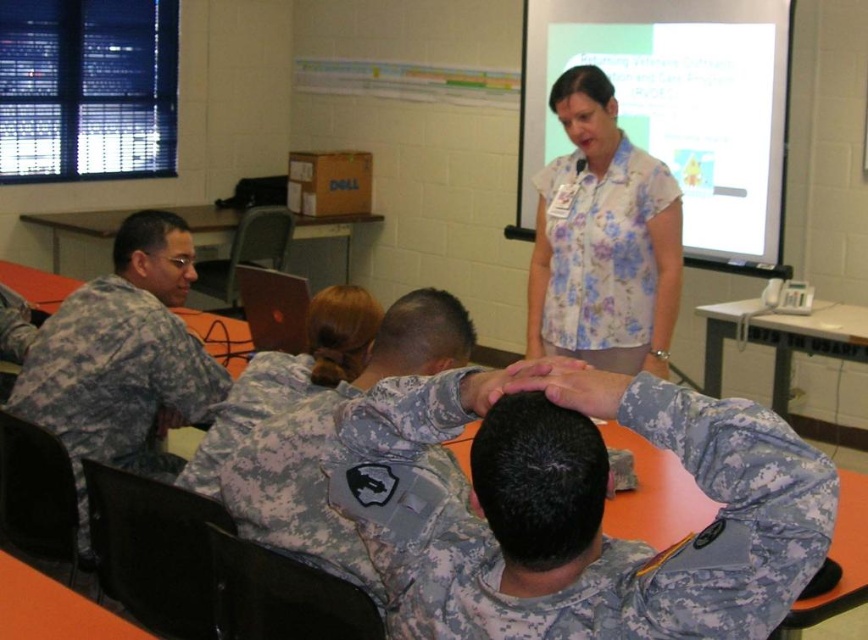
Question: Which object is closer to the camera taking this photo?

Choices:
 (A) camouflage uniform at center
 (B) floral print blouse at upper center

Answer: (A)

Question: Which point is farther to the camera?

Choices:
 (A) camouflage uniform at left
 (B) camouflage uniform at center
 (C) camouflage fabric uniform at center
 (D) floral print blouse at upper center

Answer: (D)

Question: Does camouflage uniform at left have a greater width compared to camouflage fabric uniform at center?

Choices:
 (A) yes
 (B) no

Answer: (A)

Question: Considering the real-world distances, which object is farthest from the camouflage uniform at left?

Choices:
 (A) camouflage uniform at center
 (B) camouflage fabric uniform at center
 (C) floral print blouse at upper center

Answer: (C)

Question: Can you confirm if camouflage uniform at center is positioned to the left of floral print blouse at upper center?

Choices:
 (A) no
 (B) yes

Answer: (B)

Question: Does camouflage uniform at center have a greater width compared to camouflage fabric uniform at center?

Choices:
 (A) yes
 (B) no

Answer: (A)